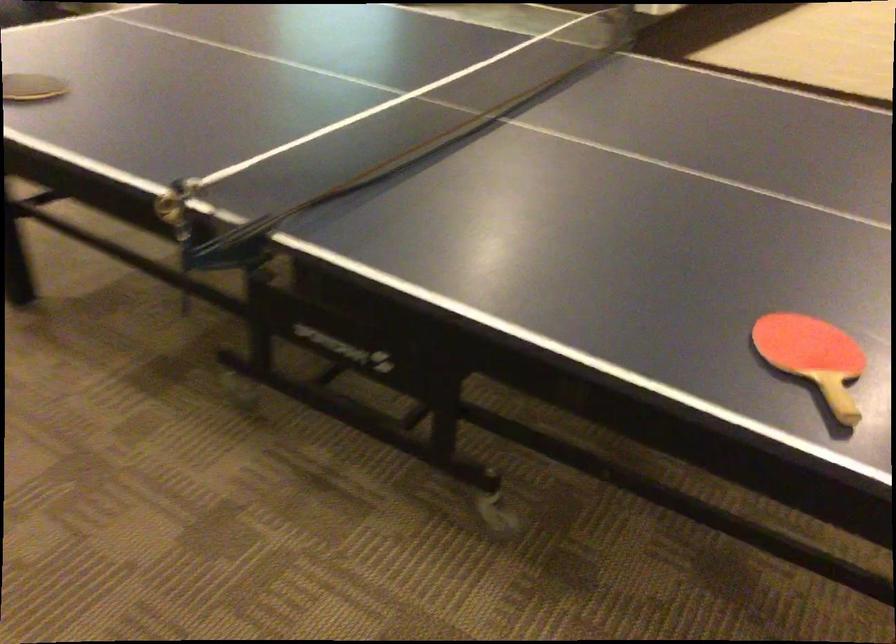
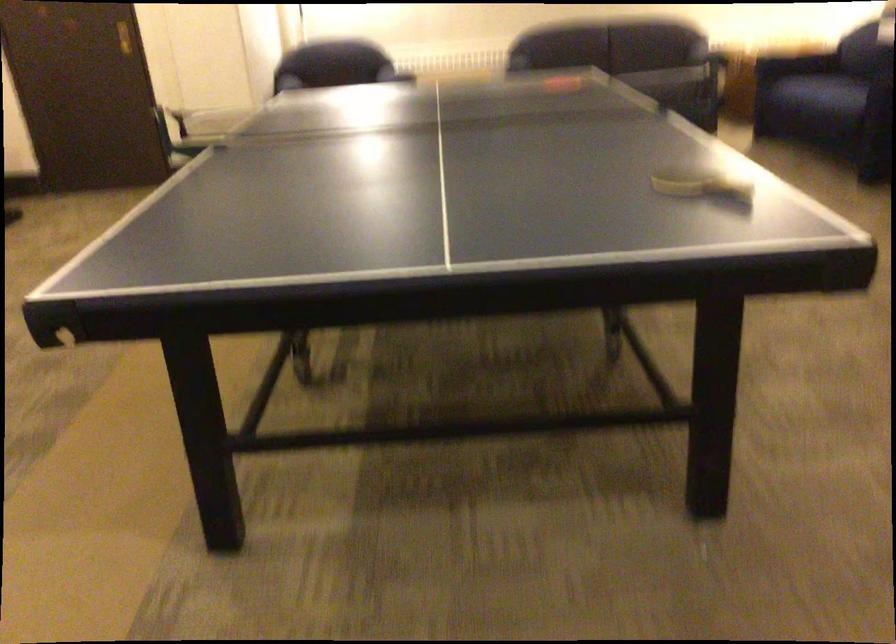
Question: I am providing you with two images of the same scene from different viewpoints. After the viewpoint changes to image2, which objects are now occluded?

Choices:
 (A) grey flip-flop
 (B) table caster wheel
 (C) chair sitting surface
 (D) ping-pong paddle

Answer: (B)